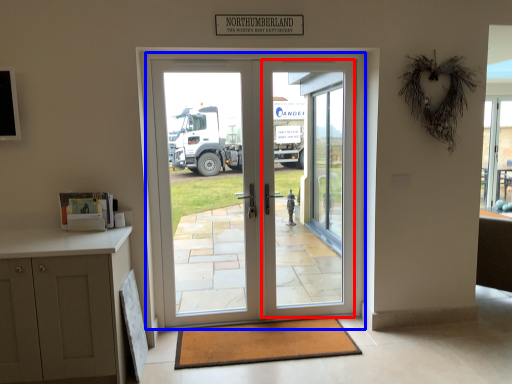
Question: Which object appears farthest to the camera in this image, screen door (highlighted by a red box) or door (highlighted by a blue box)?

Choices:
 (A) screen door
 (B) door

Answer: (A)